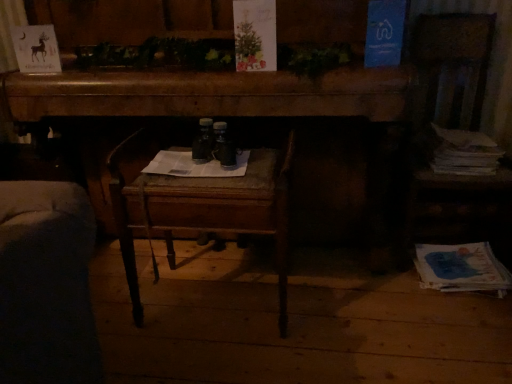
Image resolution: width=512 pixels, height=384 pixels. In order to click on vacant space that's between wooden chair at center and blue paper at lower right, the 1th magazine positioned from the bottom in this screenshot , I will do `click(348, 295)`.